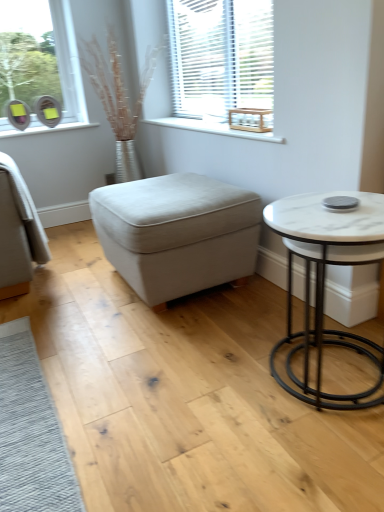
Locate an element on the screen. The height and width of the screenshot is (512, 384). white wood at upper center is located at coordinates (214, 129).

Image resolution: width=384 pixels, height=512 pixels. In order to click on beige fabric ottoman at center in this screenshot , I will do pos(177,233).

Does white marble table at right come behind beige fabric ottoman at center?

No, the depth of white marble table at right is less than that of beige fabric ottoman at center.

Who is bigger, white marble table at right or beige fabric ottoman at center?

beige fabric ottoman at center is bigger.

Does white marble table at right turn towards beige fabric ottoman at center?

No, white marble table at right does not turn towards beige fabric ottoman at center.

Is point (291, 230) positioned before point (250, 222)?

Yes, it is in front of point (250, 222).

Are white marble table at right and white wooden blinds at upper center beside each other?

No, white marble table at right is not with white wooden blinds at upper center.

Is white marble table at right taller or shorter than white wooden blinds at upper center?

Considering their sizes, white marble table at right has less height than white wooden blinds at upper center.

Between point (295, 197) and point (200, 94), which one is positioned behind?

The point (200, 94) is farther from the camera.

From the image's perspective, is white marble table at right located above or below white wooden blinds at upper center?

white marble table at right is below white wooden blinds at upper center.

Is beige fabric ottoman at center far away from white wood at upper center?

No, there isn't a large distance between beige fabric ottoman at center and white wood at upper center.

You are a GUI agent. You are given a task and a screenshot of the screen. Output one action in this format:
    pyautogui.click(x=<x>, y=<y>)
    Task: Click on the window sill above the beige fabric ottoman at center (from a real-world perspective)
    
    Given the screenshot: What is the action you would take?
    pyautogui.click(x=214, y=129)

Which is correct: beige fabric ottoman at center is inside white wood at upper center, or outside of it?

beige fabric ottoman at center exists outside the volume of white wood at upper center.

Considering the sizes of objects beige fabric ottoman at center and white marble table at right in the image provided, who is shorter, beige fabric ottoman at center or white marble table at right?

beige fabric ottoman at center is shorter.

Measure the distance from beige fabric ottoman at center to white marble table at right.

beige fabric ottoman at center and white marble table at right are 24.82 inches apart from each other.

Based on their positions, is beige fabric ottoman at center located to the left or right of white marble table at right?

In the image, beige fabric ottoman at center appears on the left side of white marble table at right.

From the image's perspective, between beige fabric ottoman at center and white marble table at right, who is located below?

white marble table at right.

Is white wooden blinds at upper center not close to beige fabric ottoman at center?

white wooden blinds at upper center is near beige fabric ottoman at center, not far away.

Is white wooden blinds at upper center bigger than beige fabric ottoman at center?

Incorrect, white wooden blinds at upper center is not larger than beige fabric ottoman at center.

Where is `music stool that is below the white wooden blinds at upper center (from the image's perspective)`? This screenshot has height=512, width=384. music stool that is below the white wooden blinds at upper center (from the image's perspective) is located at coordinates (177, 233).

Considering the relative positions of white wooden blinds at upper center and beige fabric ottoman at center in the image provided, is white wooden blinds at upper center in front of beige fabric ottoman at center?

No.

In the scene shown: Measure the distance between white wood at upper center and white marble table at right.

32.24 inches.

Does white wood at upper center have a lesser height compared to white marble table at right?

Yes.

This screenshot has width=384, height=512. In order to click on table on the right of white wood at upper center in this screenshot , I will do `click(324, 276)`.

Which is in front, point (177, 127) or point (382, 206)?

Point (382, 206)

Is white wooden blinds at upper center next to white marble table at right and touching it?

No.

Is white marble table at right at the back of white wooden blinds at upper center?

white wooden blinds at upper center does not have its back to white marble table at right.

From a real-world perspective, which object stands above the other?

white wooden blinds at upper center.

Looking at this image, in the image, is white wooden blinds at upper center positioned in front of or behind white marble table at right?

Visually, white wooden blinds at upper center is located behind white marble table at right.

Locate an element on the screen. This screenshot has width=384, height=512. table that appears in front of the beige fabric ottoman at center is located at coordinates (324, 276).

I want to click on window on the left of white marble table at right, so click(221, 57).

Looking at the image, which one is located closer to white wood at upper center, beige fabric ottoman at center or white wooden blinds at upper center?

Based on the image, white wooden blinds at upper center appears to be nearer to white wood at upper center.

Considering their positions, is beige fabric ottoman at center positioned further to white wooden blinds at upper center than white wood at upper center?

beige fabric ottoman at center lies further to white wooden blinds at upper center than the other object.

Which object lies nearer to the anchor point beige fabric ottoman at center, white wooden blinds at upper center or white marble table at right?

white marble table at right is positioned closer to the anchor beige fabric ottoman at center.

Looking at the image, which one is located further to beige fabric ottoman at center, white marble table at right or white wood at upper center?

white marble table at right.

From the picture: Looking at the image, which one is located further to beige fabric ottoman at center, white wood at upper center or white marble table at right?

white marble table at right is further to beige fabric ottoman at center.

Looking at this image, considering their positions, is beige fabric ottoman at center positioned further to white wood at upper center than white marble table at right?

white marble table at right is positioned further to the anchor white wood at upper center.

Looking at the image, which one is located further to white marble table at right, white wood at upper center or beige fabric ottoman at center?

Based on the image, white wood at upper center appears to be further to white marble table at right.

Based on their spatial positions, is white marble table at right or beige fabric ottoman at center closer to white wood at upper center?

Among the two, beige fabric ottoman at center is located nearer to white wood at upper center.

Identify the location of window sill that lies between white wooden blinds at upper center and white marble table at right from top to bottom. This screenshot has width=384, height=512. (214, 129).

Locate an element on the screen. The height and width of the screenshot is (512, 384). window sill between white wooden blinds at upper center and beige fabric ottoman at center in the up-down direction is located at coordinates 214,129.

Where is `music stool between white wooden blinds at upper center and white marble table at right in the up-down direction`? This screenshot has width=384, height=512. music stool between white wooden blinds at upper center and white marble table at right in the up-down direction is located at coordinates (177, 233).

Locate an element on the screen. music stool that lies between white wood at upper center and white marble table at right from top to bottom is located at coordinates (177, 233).